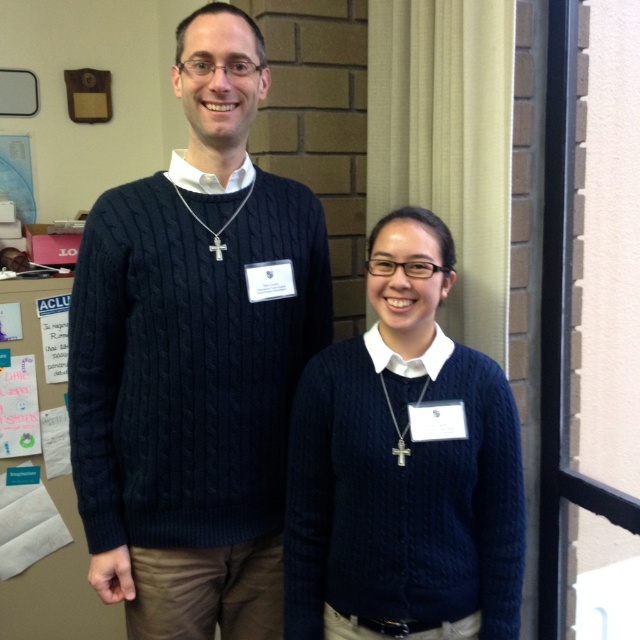
Question: Among these objects, which one is nearest to the camera?

Choices:
 (A) cable-knit sweater at center
 (B) cable-knit navy sweater at center

Answer: (B)

Question: Does cable-knit sweater at center have a lesser width compared to cable-knit navy sweater at center?

Choices:
 (A) yes
 (B) no

Answer: (B)

Question: Which object appears farthest from the camera in this image?

Choices:
 (A) cable-knit navy sweater at center
 (B) cable-knit sweater at center

Answer: (B)

Question: Which point is farther to the camera?

Choices:
 (A) (182, 547)
 (B) (387, 522)

Answer: (A)

Question: Where is cable-knit sweater at center located in relation to cable-knit navy sweater at center in the image?

Choices:
 (A) left
 (B) right

Answer: (A)

Question: Can you confirm if cable-knit sweater at center is positioned to the left of cable-knit navy sweater at center?

Choices:
 (A) no
 (B) yes

Answer: (B)